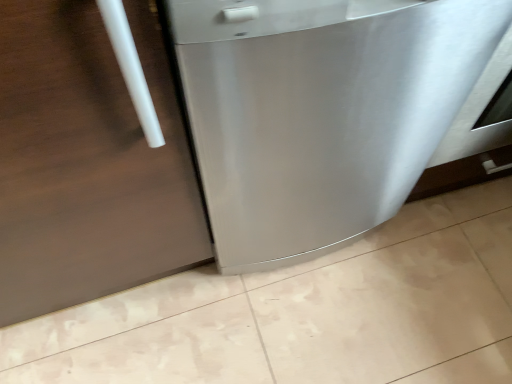
Question: Considering the relative sizes of stainless steel door at left and stainless steel dishwasher at center in the image provided, is stainless steel door at left shorter than stainless steel dishwasher at center?

Choices:
 (A) yes
 (B) no

Answer: (B)

Question: Does stainless steel door at left turn towards stainless steel dishwasher at center?

Choices:
 (A) no
 (B) yes

Answer: (A)

Question: Is stainless steel door at left not inside stainless steel dishwasher at center?

Choices:
 (A) yes
 (B) no

Answer: (A)

Question: From the image's perspective, would you say stainless steel door at left is shown under stainless steel dishwasher at center?

Choices:
 (A) yes
 (B) no

Answer: (A)

Question: Can you confirm if stainless steel door at left is positioned to the right of stainless steel dishwasher at center?

Choices:
 (A) no
 (B) yes

Answer: (A)

Question: From the image's perspective, would you say stainless steel door at left is positioned over stainless steel dishwasher at center?

Choices:
 (A) no
 (B) yes

Answer: (A)

Question: Considering the relative sizes of stainless steel dishwasher at center and stainless steel door at left in the image provided, is stainless steel dishwasher at center smaller than stainless steel door at left?

Choices:
 (A) no
 (B) yes

Answer: (B)

Question: From a real-world perspective, is stainless steel dishwasher at center physically below stainless steel door at left?

Choices:
 (A) no
 (B) yes

Answer: (B)

Question: Could stainless steel door at left be considered to be inside stainless steel dishwasher at center?

Choices:
 (A) yes
 (B) no

Answer: (B)

Question: Is stainless steel dishwasher at center outside stainless steel door at left?

Choices:
 (A) no
 (B) yes

Answer: (B)

Question: Is the depth of stainless steel dishwasher at center greater than that of stainless steel door at left?

Choices:
 (A) no
 (B) yes

Answer: (B)

Question: Does stainless steel dishwasher at center have a lesser width compared to stainless steel door at left?

Choices:
 (A) yes
 (B) no

Answer: (B)

Question: From a real-world perspective, is stainless steel door at left physically located above or below stainless steel dishwasher at center?

Choices:
 (A) below
 (B) above

Answer: (B)